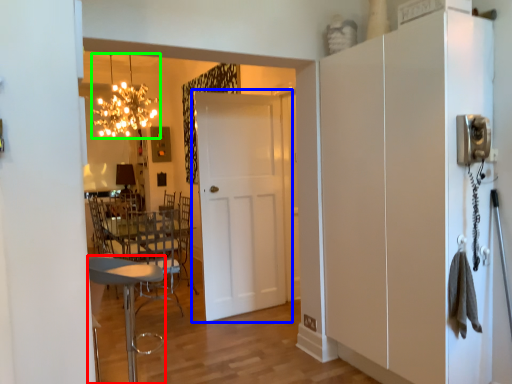
Question: Which object is the farthest from chair (highlighted by a red box)? Choose among these: door (highlighted by a blue box) or light fixture (highlighted by a green box).

Choices:
 (A) door
 (B) light fixture

Answer: (B)